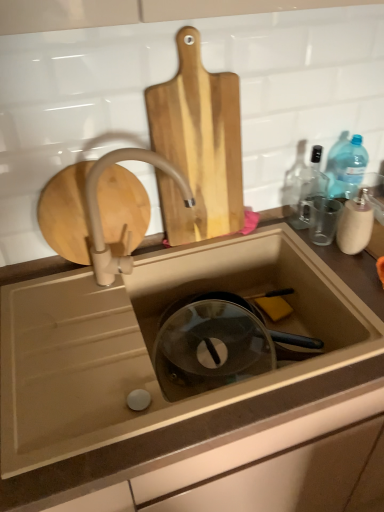
In order to face transparent glass bottle at upper right, should I rotate leftwards or rightwards?

Rotate your view right by about 15.864°.

Find the location of a particular element. The width and height of the screenshot is (384, 512). white matte faucet at upper center is located at coordinates (100, 215).

This screenshot has height=512, width=384. What are the coordinates of `yellow sponge at sink bottom` in the screenshot? It's located at click(274, 307).

Considering the sizes of objects transparent glass bottle at upper right and natural wood cutting board at upper center in the image provided, who is bigger, transparent glass bottle at upper right or natural wood cutting board at upper center?

natural wood cutting board at upper center is bigger.

Which is less distant, (301, 177) or (165, 113)?

Positioned in front is point (165, 113).

Does transparent glass bottle at upper right have a greater height compared to natural wood cutting board at upper center?

Incorrect, the height of transparent glass bottle at upper right is not larger of that of natural wood cutting board at upper center.

Is the surface of transparent glass bottle at upper right in direct contact with natural wood cutting board at upper center?

No, transparent glass bottle at upper right is not next to natural wood cutting board at upper center.

Between white matte faucet at upper center and yellow sponge at sink bottom, which one has smaller width?

yellow sponge at sink bottom is thinner.

From the image's perspective, which one is positioned lower, white matte faucet at upper center or yellow sponge at sink bottom?

yellow sponge at sink bottom.

From the picture: Is white matte faucet at upper center taller or shorter than yellow sponge at sink bottom?

white matte faucet at upper center is taller than yellow sponge at sink bottom.

Considering the relative sizes of white matte faucet at upper center and yellow sponge at sink bottom in the image provided, is white matte faucet at upper center bigger than yellow sponge at sink bottom?

Correct, white matte faucet at upper center is larger in size than yellow sponge at sink bottom.

Does natural wood cutting board at upper center have a smaller size compared to translucent plastic sink at center?

Yes, natural wood cutting board at upper center is smaller than translucent plastic sink at center.

How many degrees apart are the facing directions of natural wood cutting board at upper center and translucent plastic sink at center?

They differ by 0.0023 degrees in their facing directions.

Is point (188, 64) positioned behind point (279, 382)?

Yes.

Considering the sizes of objects natural wood cutting board at upper center and translucent plastic sink at center in the image provided, who is wider, natural wood cutting board at upper center or translucent plastic sink at center?

translucent plastic sink at center.

Considering the positions of objects translucent plastic sink at center and yellow sponge at sink bottom in the image provided, who is more to the left, translucent plastic sink at center or yellow sponge at sink bottom?

translucent plastic sink at center is more to the left.

Based on the photo, is translucent plastic sink at center turned away from yellow sponge at sink bottom?

Correct, translucent plastic sink at center is looking away from yellow sponge at sink bottom.

From a real-world perspective, is translucent plastic sink at center positioned under yellow sponge at sink bottom based on gravity?

Indeed, from a real-world perspective, translucent plastic sink at center is positioned beneath yellow sponge at sink bottom.

In the image, is translucent plastic sink at center positioned in front of or behind yellow sponge at sink bottom?

Clearly, translucent plastic sink at center is in front of yellow sponge at sink bottom.

From a real-world perspective, is translucent plastic sink at center beneath natural wood cutting board at upper center?

Indeed, from a real-world perspective, translucent plastic sink at center is positioned beneath natural wood cutting board at upper center.

Between point (296, 329) and point (189, 234), which one is positioned in front?

The point (189, 234) is more forward.

Does translucent plastic sink at center appear on the right side of natural wood cutting board at upper center?

Yes, translucent plastic sink at center is to the right of natural wood cutting board at upper center.

Locate an element on the screen. The height and width of the screenshot is (512, 384). sink lying in front of the natural wood cutting board at upper center is located at coordinates (156, 342).

Is natural wood cutting board at upper center to the right of transparent glass bottle at upper right from the viewer's perspective?

No.

Is point (195, 30) farther from viewer compared to point (301, 209)?

No, (195, 30) is closer to viewer.

Which of these two, natural wood cutting board at upper center or transparent glass bottle at upper right, is thinner?

With smaller width is natural wood cutting board at upper center.

The image size is (384, 512). I want to click on bottle lying behind the natural wood cutting board at upper center, so click(309, 190).

How many degrees apart are the facing directions of yellow sponge at sink bottom and translucent plastic sink at center?

The angle between the facing direction of yellow sponge at sink bottom and the facing direction of translucent plastic sink at center is 5.84 degrees.

From the image's perspective, does yellow sponge at sink bottom appear higher than translucent plastic sink at center?

Yes, from the image's perspective, yellow sponge at sink bottom is over translucent plastic sink at center.

Who is smaller, yellow sponge at sink bottom or translucent plastic sink at center?

With smaller size is yellow sponge at sink bottom.

I want to click on cutting board that appears in front of the transparent glass bottle at upper right, so click(x=198, y=145).

Where is `tap above the yellow sponge at sink bottom (from a real-world perspective)`? tap above the yellow sponge at sink bottom (from a real-world perspective) is located at coordinates (100, 215).

Based on their spatial positions, is white matte faucet at upper center or yellow sponge at sink bottom further from natural wood cutting board at upper center?

yellow sponge at sink bottom.

Considering their positions, is translucent plastic sink at center positioned closer to white matte faucet at upper center than yellow sponge at sink bottom?

translucent plastic sink at center.

From the image, which object appears to be farther from natural wood cutting board at upper center, transparent glass bottle at upper right or white matte faucet at upper center?

Among the two, transparent glass bottle at upper right is located further to natural wood cutting board at upper center.

From the picture: Which object lies further to the anchor point yellow sponge at sink bottom, natural wood cutting board at upper center or transparent glass bottle at upper right?

Among the two, natural wood cutting board at upper center is located further to yellow sponge at sink bottom.

Which object lies further to the anchor point translucent plastic sink at center, yellow sponge at sink bottom or white matte faucet at upper center?

yellow sponge at sink bottom lies further to translucent plastic sink at center than the other object.

Consider the image. Looking at the image, which one is located closer to transparent glass bottle at upper right, white matte faucet at upper center or translucent plastic sink at center?

The object closer to transparent glass bottle at upper right is translucent plastic sink at center.

When comparing their distances from yellow sponge at sink bottom, does natural wood cutting board at upper center or white matte faucet at upper center seem closer?

natural wood cutting board at upper center lies closer to yellow sponge at sink bottom than the other object.

Which object lies further to the anchor point transparent glass bottle at upper right, yellow sponge at sink bottom or natural wood cutting board at upper center?

Among the two, natural wood cutting board at upper center is located further to transparent glass bottle at upper right.

Identify the location of bottle between natural wood cutting board at upper center and translucent plastic sink at center vertically. The width and height of the screenshot is (384, 512). (309, 190).

Find the location of `tap that lies between natural wood cutting board at upper center and translucent plastic sink at center from top to bottom`. tap that lies between natural wood cutting board at upper center and translucent plastic sink at center from top to bottom is located at coordinates (100, 215).

This screenshot has width=384, height=512. Identify the location of soap between transparent glass bottle at upper right and translucent plastic sink at center in the vertical direction. (274, 307).

Locate an element on the screen. This screenshot has height=512, width=384. soap located between white matte faucet at upper center and transparent glass bottle at upper right in the left-right direction is located at coordinates (274, 307).